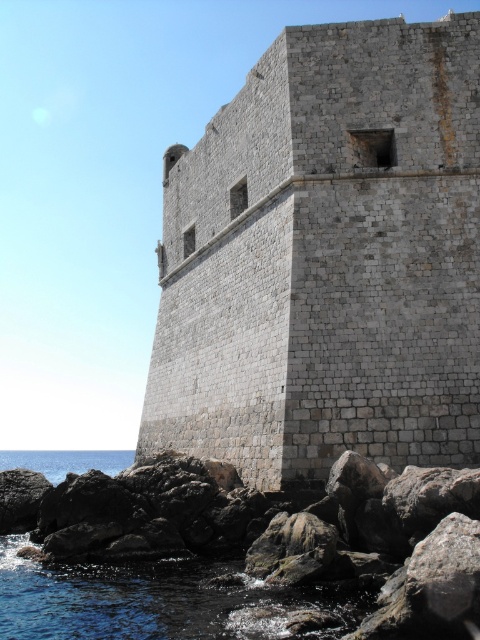
You are a historian examining the image of the historic stone wall. You need to locate the rough stone rocks at lower left for your analysis. What are their exact coordinates in the image?

The rough stone rocks at lower left are located at coordinates point (134, 602).

You are a historian examining the image of a historic site. You need to determine which object, the gray stone wall at center or the blue water at lower left, is taller in the scene. Based on the description, which one is taller?

The gray stone wall at center is taller than the blue water at lower left according to the description.